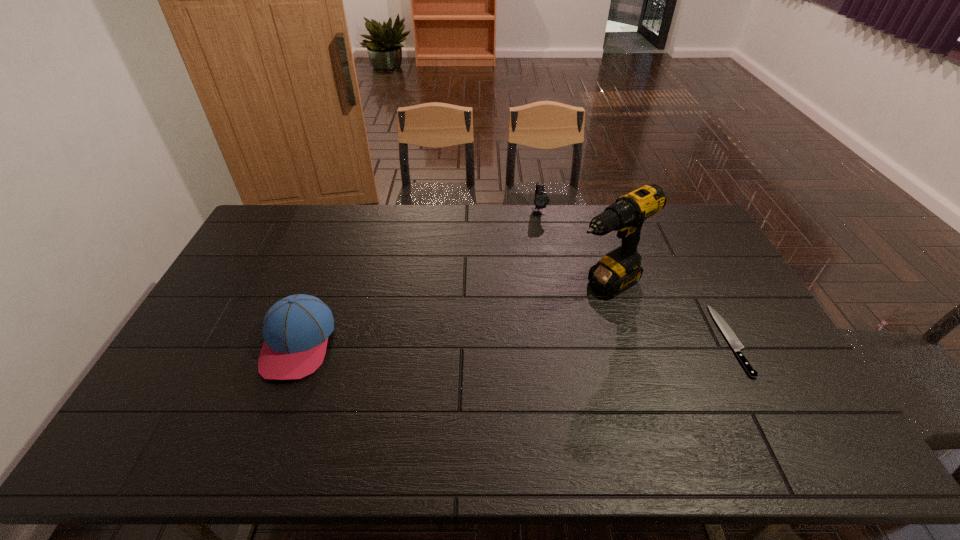
Find the location of a particular element. This screenshot has width=960, height=540. vacant position located on the face of the third object from right to left is located at coordinates (544, 240).

Identify the location of free region located 0.350m on the face of the third object from right to left. This screenshot has width=960, height=540. (551, 281).

I want to click on free space located at the tip of the second object from right to left, so click(x=496, y=354).

At what (x,y) coordinates should I click in order to perform the action: click on vacant region located at the tip of the second object from right to left. Please return your answer as a coordinate pair (x, y). Looking at the image, I should click on (496, 354).

This screenshot has height=540, width=960. What are the coordinates of `vacant space located 0.290m at the tip of the second object from right to left` in the screenshot? It's located at (510, 345).

Locate an element on the screen. object that is at the far edge is located at coordinates (541, 199).

Where is `object present at the right edge`? object present at the right edge is located at coordinates (731, 337).

Locate an element on the screen. The height and width of the screenshot is (540, 960). vacant space at the far edge of the desktop is located at coordinates pyautogui.click(x=409, y=216).

The image size is (960, 540). In the image, there is a desktop. Identify the location of free region at the near edge. (381, 408).

Locate an element on the screen. The width and height of the screenshot is (960, 540). vacant space at the left edge of the desktop is located at coordinates (175, 384).